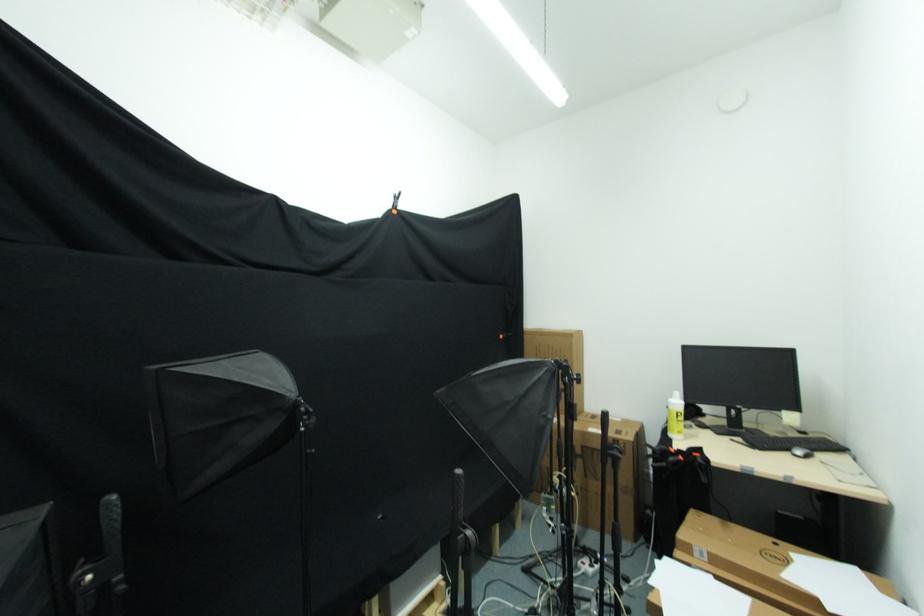
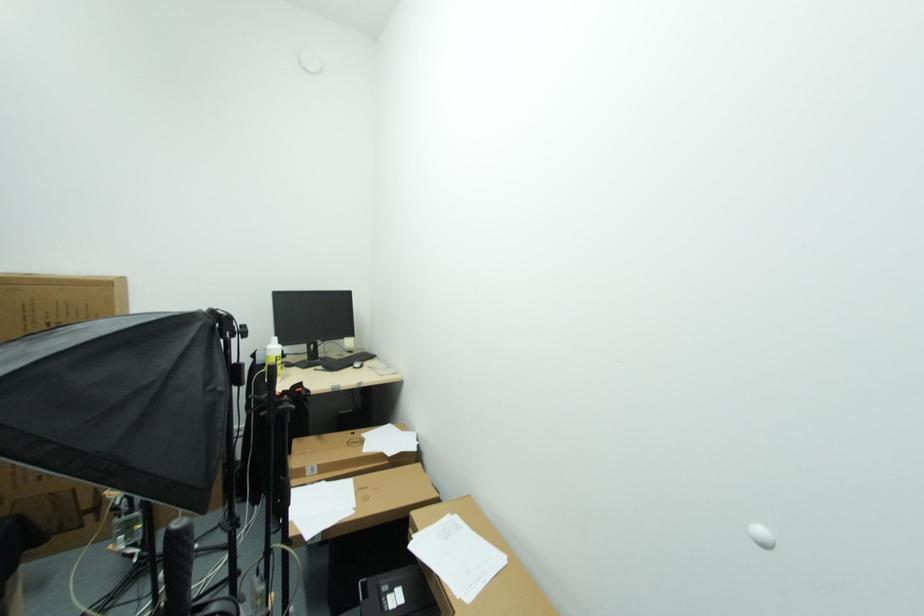
The point at (801,456) is marked in the first image. Where is the corresponding point in the second image?

(359, 368)